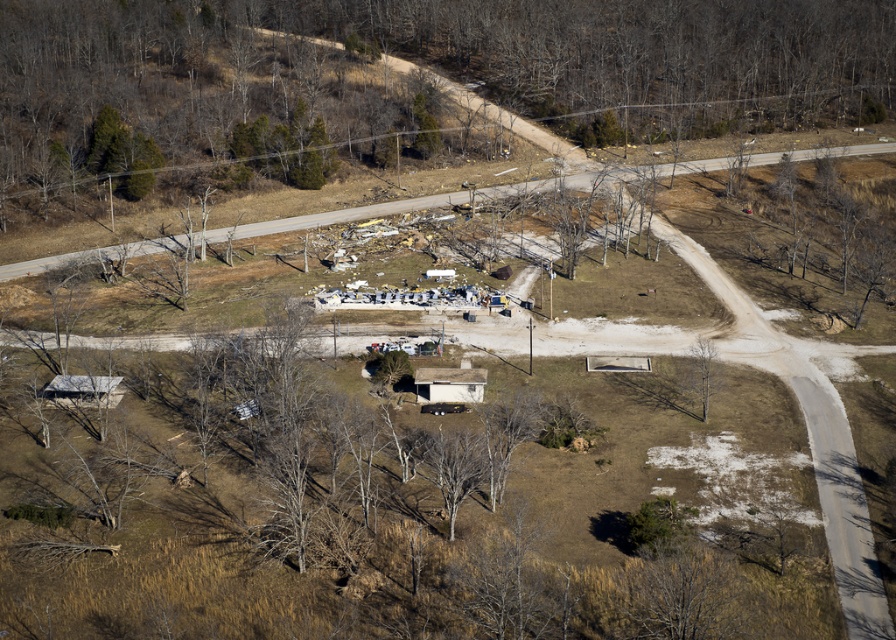
You are a bird flying over the rural area shown in the image. You want to land on the tallest tree to rest. Which tree should you choose between the bare wood tree at center and the bare wood tree at lower right?

The bare wood tree at center is bigger than the bare wood tree at lower right, so you should choose the bare wood tree at center to land on since it is taller.

You are a drone operator flying a drone over the rural area. You need to capture a photo of the green leafy tree at center without the bare wood tree at lower right blocking it. Is this possible based on their positions?

The bare wood tree at lower right is in front of the green leafy tree at center, so the drone cannot capture a clear photo of the green leafy tree at center without the bare wood tree at lower right blocking it.

You are a drone operator tasked with capturing an aerial image of a rural area. You need to ensure that the camera is pointed at the bare wood tree at lower right. Given that the drone is currently at the point marked by coordinates point (703,371), which is the location of the bare wood tree at lower right, can you confirm if the drone is already positioned correctly?

The point (703,371) marks the bare wood tree at lower right, so the drone is already positioned correctly at that point.